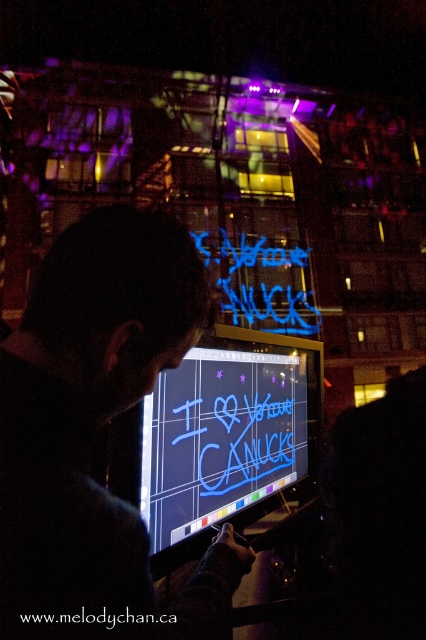
You are a photographer taking a picture of the black fabric at center and the neon blue text at center. Which object will appear larger in your photo?

The black fabric at center will appear larger in the photo because it is closer to the viewer than the neon blue text at center.

You are a tailor who needs to determine if a piece of black fabric at center can be used to cover a neon blue text at center. Based on the scene, which object is thinner and therefore might be easier to cover?

The black fabric at center is thinner than the neon blue text at center, so it might be easier to cover the black fabric at center with the neon blue text at center.